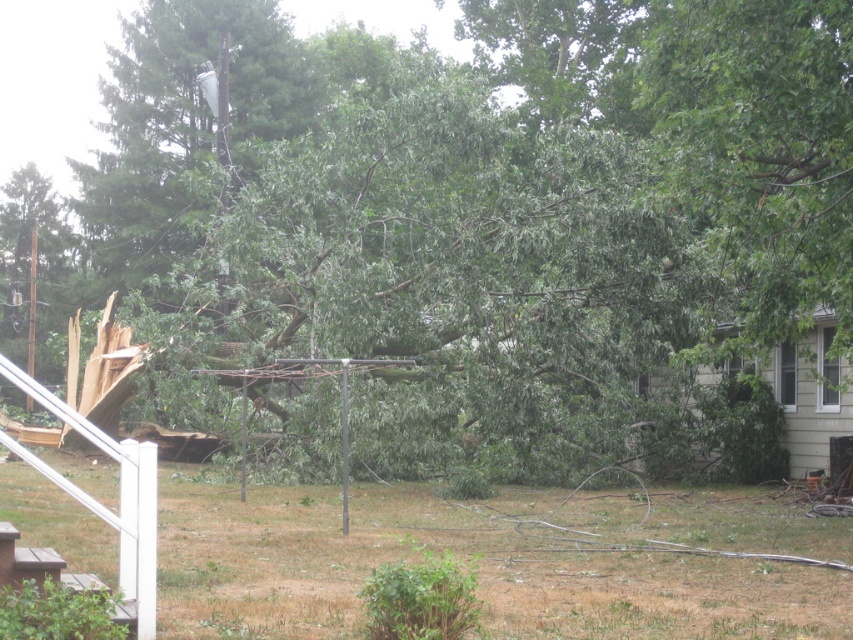
Question: Is brown grass at lower center positioned in front of green leafy tree at upper right?

Choices:
 (A) yes
 (B) no

Answer: (A)

Question: Which of the following is the closest to the observer?

Choices:
 (A) (590, 531)
 (B) (837, 253)

Answer: (B)

Question: Is brown grass at lower center below green leafy tree at upper right?

Choices:
 (A) no
 (B) yes

Answer: (B)

Question: Which object appears closest to the camera in this image?

Choices:
 (A) brown grass at lower center
 (B) green leafy tree at upper right

Answer: (A)

Question: Is brown grass at lower center positioned in front of green leafy tree at upper right?

Choices:
 (A) yes
 (B) no

Answer: (A)